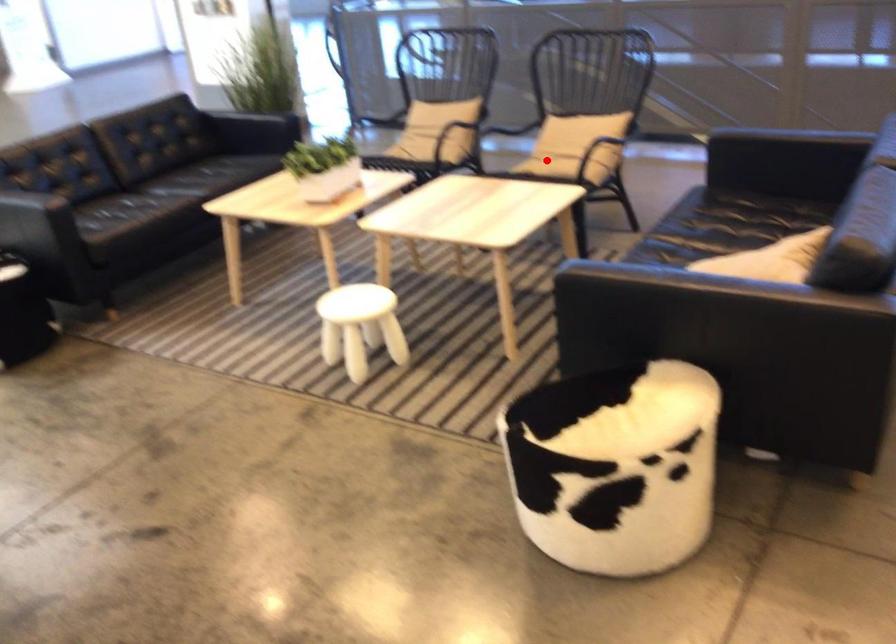
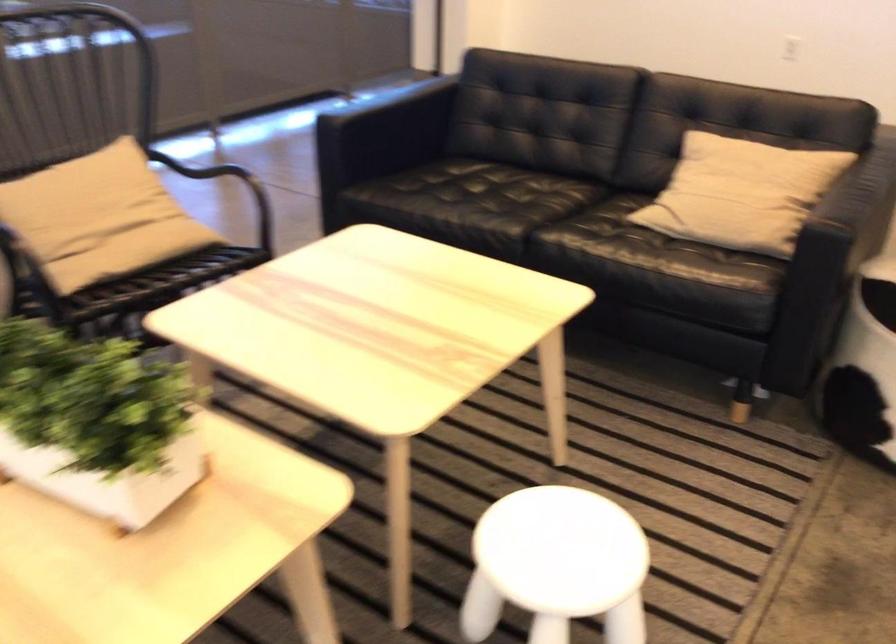
The point at the highlighted location is marked in the first image. Where is the corresponding point in the second image?

(151, 254)